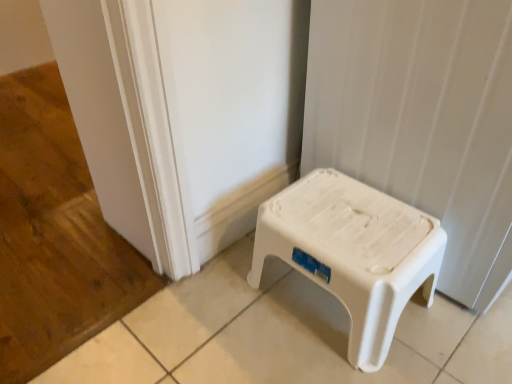
Question: Is white plastic stool at center positioned behind white plastic stool at lower right?

Choices:
 (A) no
 (B) yes

Answer: (B)

Question: From a real-world perspective, is white plastic stool at center over white plastic stool at lower right?

Choices:
 (A) no
 (B) yes

Answer: (A)

Question: Does white plastic stool at center touch white plastic stool at lower right?

Choices:
 (A) yes
 (B) no

Answer: (B)

Question: Is white plastic stool at center completely or partially outside of white plastic stool at lower right?

Choices:
 (A) yes
 (B) no

Answer: (A)

Question: Is white plastic stool at center oriented towards white plastic stool at lower right?

Choices:
 (A) yes
 (B) no

Answer: (B)

Question: Can you confirm if white plastic stool at center is wider than white plastic stool at lower right?

Choices:
 (A) yes
 (B) no

Answer: (B)

Question: Is white plastic stool at lower right to the right of white plastic stool at center from the viewer's perspective?

Choices:
 (A) yes
 (B) no

Answer: (A)

Question: Is white plastic stool at lower right turned away from white plastic stool at center?

Choices:
 (A) no
 (B) yes

Answer: (A)

Question: Can you confirm if white plastic stool at lower right is thinner than white plastic stool at center?

Choices:
 (A) yes
 (B) no

Answer: (B)

Question: Is there a large distance between white plastic stool at lower right and white plastic stool at center?

Choices:
 (A) yes
 (B) no

Answer: (B)

Question: From a real-world perspective, is white plastic stool at lower right positioned over white plastic stool at center based on gravity?

Choices:
 (A) no
 (B) yes

Answer: (B)

Question: Does white plastic stool at lower right have a greater width compared to white plastic stool at center?

Choices:
 (A) no
 (B) yes

Answer: (B)

Question: Considering the positions of white plastic stool at lower right and white plastic stool at center in the image, is white plastic stool at lower right bigger or smaller than white plastic stool at center?

Choices:
 (A) big
 (B) small

Answer: (A)